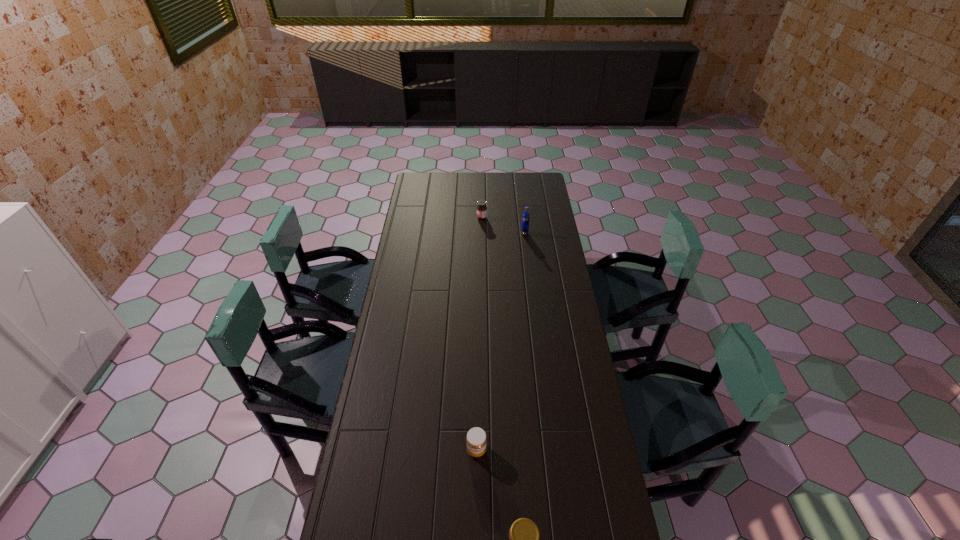
Image resolution: width=960 pixels, height=540 pixels. Find the location of `the rightmost object`. the rightmost object is located at coordinates (525, 217).

Where is `the third nearest object`? This screenshot has width=960, height=540. the third nearest object is located at coordinates (525, 217).

Find the location of `the farthest object`. the farthest object is located at coordinates (481, 208).

Identify the location of the second nearest jam. The image size is (960, 540). coord(476,439).

Identify the location of vacant space located 0.100m on the left of the rightmost object. The image size is (960, 540). (502, 233).

Where is `vacant region located on the label side of the farthest jam`? The image size is (960, 540). vacant region located on the label side of the farthest jam is located at coordinates (412, 218).

At what (x,y) coordinates should I click in order to perform the action: click on free region located 0.060m on the label side of the farthest jam. Please return your answer as a coordinate pair (x, y). The image size is (960, 540). Looking at the image, I should click on (466, 218).

The width and height of the screenshot is (960, 540). Find the location of `vacant space positioned on the label side of the farthest jam`. vacant space positioned on the label side of the farthest jam is located at coordinates (439, 218).

The width and height of the screenshot is (960, 540). What are the coordinates of `free space located on the front label of the third farthest object` in the screenshot? It's located at (476, 522).

Locate an element on the screen. This screenshot has height=540, width=960. object at the right edge is located at coordinates (525, 217).